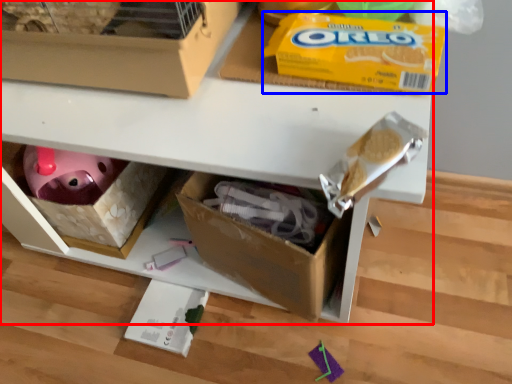
Question: Which object is closer to the camera taking this photo, shelf (highlighted by a red box) or cereal (highlighted by a blue box)?

Choices:
 (A) shelf
 (B) cereal

Answer: (A)